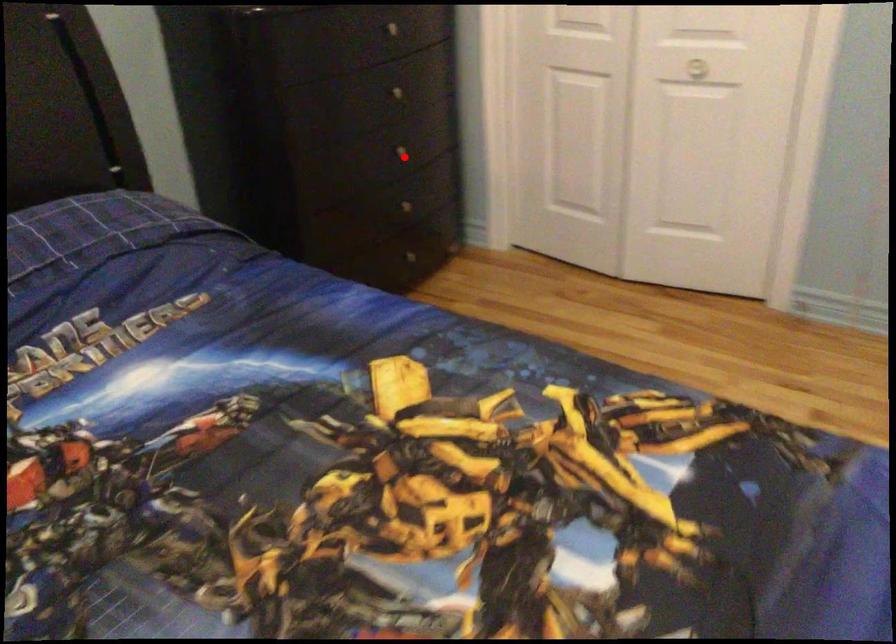
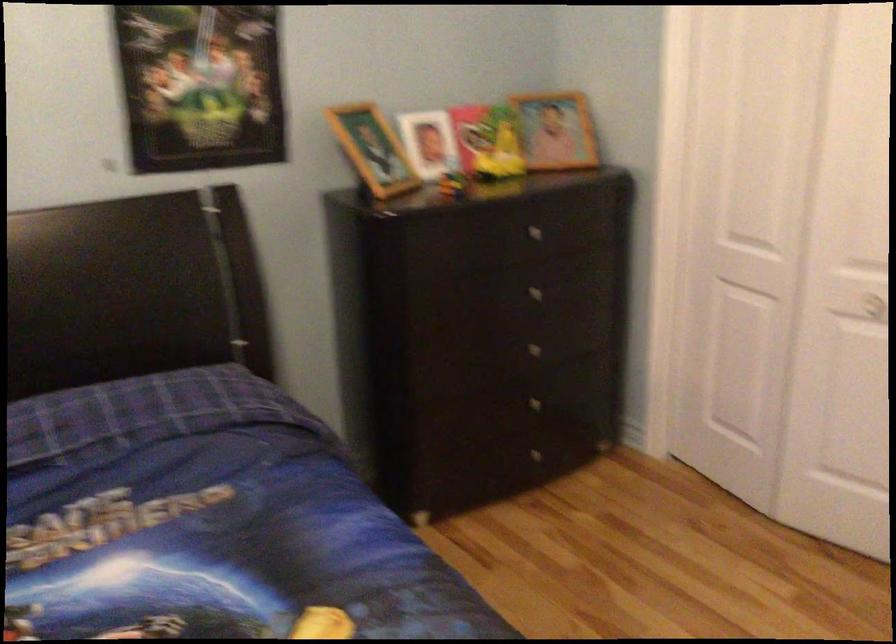
The point at the highlighted location is marked in the first image. Where is the corresponding point in the second image?

(539, 353)